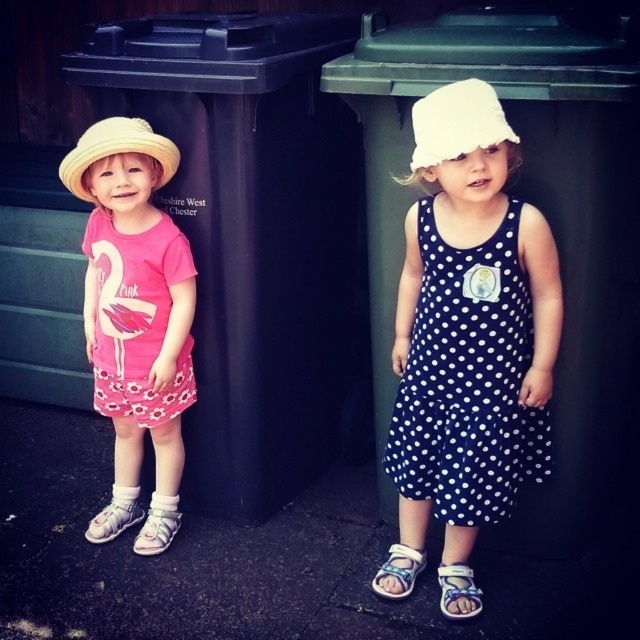
Does navy polka dot dress at right appear on the left side of white fabric sandal at lower center?

Incorrect, navy polka dot dress at right is not on the left side of white fabric sandal at lower center.

Which is behind, point (426, 429) or point (394, 580)?

The point (394, 580) is more distant.

Is point (513, 333) farther from viewer compared to point (416, 566)?

No, it is in front of (416, 566).

Image resolution: width=640 pixels, height=640 pixels. I want to click on navy polka dot dress at right, so click(468, 380).

Which is behind, point (380, 205) or point (109, 364)?

The point (109, 364) is behind.

You are a GUI agent. You are given a task and a screenshot of the screen. Output one action in this format:
    pyautogui.click(x=<x>, y=<y>)
    Task: Click on the green plastic recycling bin at upper center
    
    Given the screenshot: What is the action you would take?
    pyautogui.click(x=544, y=212)

Can you confirm if white fabric hat at upper right is smaller than straw hat at left?

Correct, white fabric hat at upper right occupies less space than straw hat at left.

Does white fabric hat at upper right have a lesser height compared to straw hat at left?

Indeed, white fabric hat at upper right has a lesser height compared to straw hat at left.

Where is `white fabric hat at upper right`? white fabric hat at upper right is located at coordinates [456, 124].